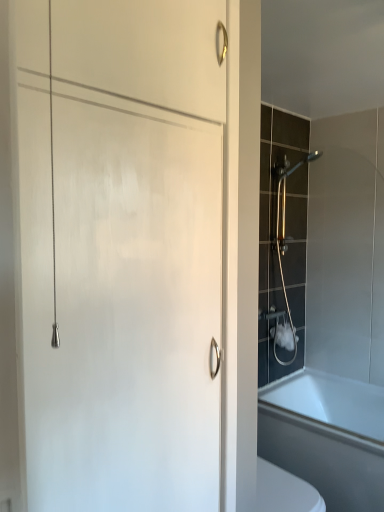
Question: Is white glossy bathtub at lower right looking in the opposite direction of gold metallic shower at right?

Choices:
 (A) no
 (B) yes

Answer: (A)

Question: Is gold metallic shower at right surrounded by white glossy bathtub at lower right?

Choices:
 (A) no
 (B) yes

Answer: (A)

Question: Is white glossy bathtub at lower right at the left side of gold metallic shower at right?

Choices:
 (A) yes
 (B) no

Answer: (B)

Question: Is white glossy bathtub at lower right shorter than gold metallic shower at right?

Choices:
 (A) yes
 (B) no

Answer: (A)

Question: Does white glossy bathtub at lower right turn towards gold metallic shower at right?

Choices:
 (A) yes
 (B) no

Answer: (B)

Question: From a real-world perspective, is white glossy bathtub at lower right positioned under gold metallic shower at right based on gravity?

Choices:
 (A) no
 (B) yes

Answer: (B)

Question: From a real-world perspective, is gold metallic shower at right located higher than white glossy bathtub at lower right?

Choices:
 (A) yes
 (B) no

Answer: (A)

Question: From the image's perspective, would you say gold metallic shower at right is positioned over white glossy bathtub at lower right?

Choices:
 (A) yes
 (B) no

Answer: (A)

Question: Can you confirm if gold metallic shower at right is smaller than white glossy bathtub at lower right?

Choices:
 (A) no
 (B) yes

Answer: (B)

Question: From the image's perspective, is gold metallic shower at right located beneath white glossy bathtub at lower right?

Choices:
 (A) no
 (B) yes

Answer: (A)

Question: Is gold metallic shower at right facing away from white glossy bathtub at lower right?

Choices:
 (A) no
 (B) yes

Answer: (A)

Question: Considering the relative sizes of gold metallic shower at right and white glossy bathtub at lower right in the image provided, is gold metallic shower at right taller than white glossy bathtub at lower right?

Choices:
 (A) yes
 (B) no

Answer: (A)

Question: Is gold metallic shower at right inside or outside of white glossy bathtub at lower right?

Choices:
 (A) inside
 (B) outside

Answer: (B)